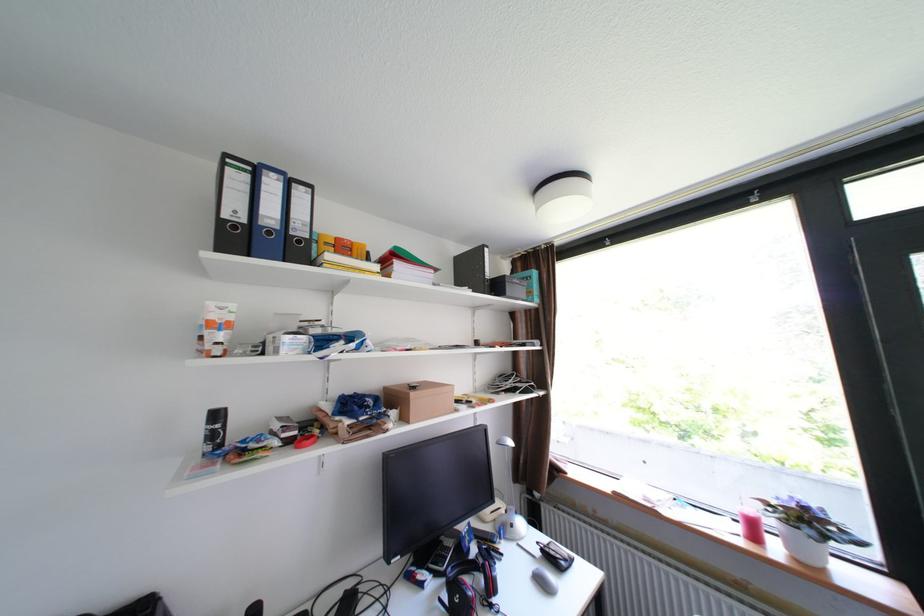
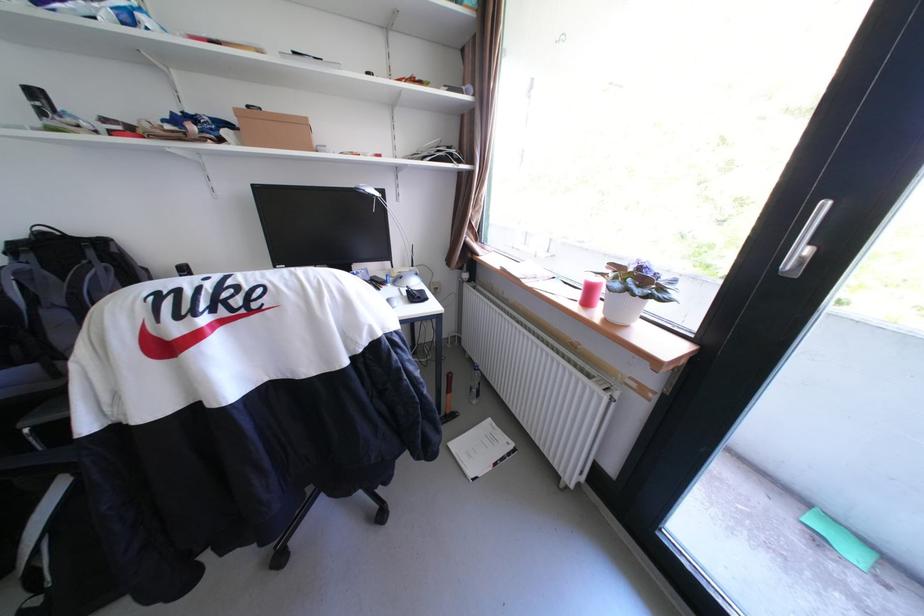
Question: I am providing you with two images of the same scene from different viewpoints. After the viewpoint changes to image2, which objects are now occluded?

Choices:
 (A) red candle
 (B) computer mouse
 (C) pink soap bottle
 (D) black calculator

Answer: (D)